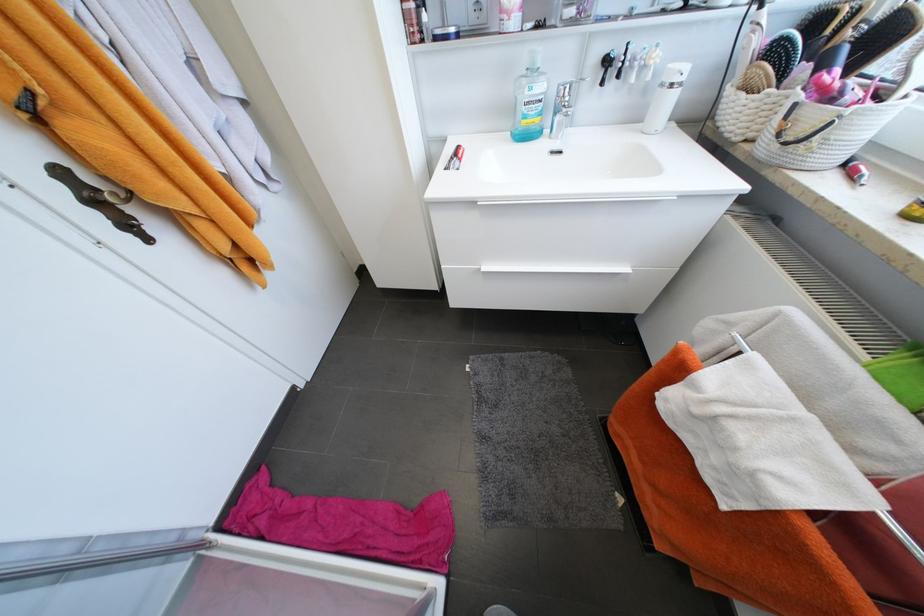
Where is `black hairbrush handle`? The width and height of the screenshot is (924, 616). black hairbrush handle is located at coordinates tap(606, 65).